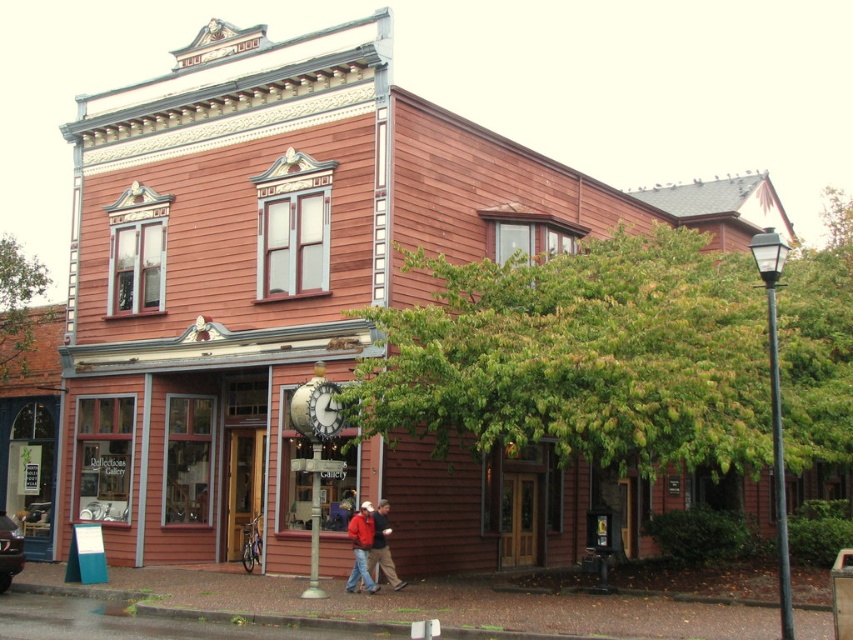
Does wooden storefront at center have a smaller size compared to red jacket at center?

No.

Image resolution: width=853 pixels, height=640 pixels. I want to click on wooden storefront at center, so click(x=204, y=438).

Find the location of a particular element. Image resolution: width=853 pixels, height=640 pixels. wooden storefront at center is located at coordinates (204, 438).

Can you confirm if red jacket at center is wider than wooden clock at center?

Correct, the width of red jacket at center exceeds that of wooden clock at center.

Can you confirm if red jacket at center is positioned below wooden clock at center?

Yes.

Is point (384, 504) behind point (329, 397)?

Yes, point (384, 504) is behind point (329, 397).

At what (x,y) coordinates should I click in order to perform the action: click on red jacket at center. Please return your answer as a coordinate pair (x, y). Looking at the image, I should click on (370, 547).

Can you confirm if wooden storefront at center is smaller than wooden clock at center?

Incorrect, wooden storefront at center is not smaller in size than wooden clock at center.

Does wooden storefront at center have a lesser width compared to wooden clock at center?

In fact, wooden storefront at center might be wider than wooden clock at center.

Is point (345, 432) positioned in front of point (308, 428)?

That is False.

The width and height of the screenshot is (853, 640). In order to click on wooden storefront at center in this screenshot , I will do `click(204, 438)`.